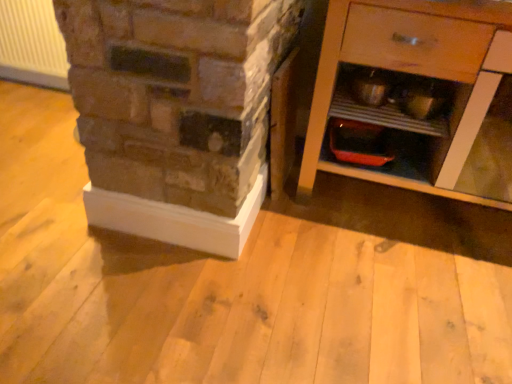
Find the location of a particular element. The height and width of the screenshot is (384, 512). white plastic radiator at upper left is located at coordinates (31, 38).

What do you see at coordinates (31, 38) in the screenshot? I see `white plastic radiator at upper left` at bounding box center [31, 38].

What do you see at coordinates (424, 89) in the screenshot? I see `wooden cabinet at right` at bounding box center [424, 89].

Measure the distance between point (430, 39) and camera.

Point (430, 39) is 1.35 meters from camera.

Identify the location of wooden cabinet at right. (424, 89).

Where is `white plastic radiator at upper left`? white plastic radiator at upper left is located at coordinates (31, 38).

Based on the photo, considering the relative positions of white plastic radiator at upper left and wooden cabinet at right in the image provided, is white plastic radiator at upper left to the right of wooden cabinet at right from the viewer's perspective?

Incorrect, white plastic radiator at upper left is not on the right side of wooden cabinet at right.

Which object is closer to the camera, white plastic radiator at upper left or wooden cabinet at right?

wooden cabinet at right is closer to the camera.

Does point (3, 15) come farther from viewer compared to point (462, 151)?

Yes, point (3, 15) is behind point (462, 151).

From the image's perspective, which is below, white plastic radiator at upper left or wooden cabinet at right?

wooden cabinet at right is shown below in the image.

From a real-world perspective, which object rests below the other?

white plastic radiator at upper left, from a real-world perspective.

Which of these two, white plastic radiator at upper left or wooden cabinet at right, is thinner?

With smaller width is white plastic radiator at upper left.

Is white plastic radiator at upper left shorter than wooden cabinet at right?

Correct, white plastic radiator at upper left is not as tall as wooden cabinet at right.

Can you confirm if white plastic radiator at upper left is smaller than wooden cabinet at right?

Indeed, white plastic radiator at upper left has a smaller size compared to wooden cabinet at right.

Which is correct: white plastic radiator at upper left is inside wooden cabinet at right, or outside of it?

white plastic radiator at upper left is spatially situated outside wooden cabinet at right.

Is white plastic radiator at upper left far from wooden cabinet at right?

Indeed, white plastic radiator at upper left is not near wooden cabinet at right.

Is white plastic radiator at upper left aimed at wooden cabinet at right?

No, white plastic radiator at upper left does not turn towards wooden cabinet at right.

Can you tell me how much white plastic radiator at upper left and wooden cabinet at right differ in facing direction?

0.0439 degrees separate the facing orientations of white plastic radiator at upper left and wooden cabinet at right.

In order to click on chest of drawers in front of the white plastic radiator at upper left in this screenshot , I will do `click(424, 89)`.

Is wooden cabinet at right to the left or to the right of white plastic radiator at upper left in the image?

Clearly, wooden cabinet at right is on the right of white plastic radiator at upper left in the image.

Between wooden cabinet at right and white plastic radiator at upper left, which one is positioned behind?

Positioned behind is white plastic radiator at upper left.

Considering the positions of point (496, 172) and point (2, 56), is point (496, 172) closer or farther from the camera than point (2, 56)?

Point (496, 172) appears to be closer to the viewer than point (2, 56).

From the image's perspective, is wooden cabinet at right located beneath white plastic radiator at upper left?

Yes, from the image's perspective, wooden cabinet at right is beneath white plastic radiator at upper left.

From a real-world perspective, who is located lower, wooden cabinet at right or white plastic radiator at upper left?

In real-world perspective, white plastic radiator at upper left is lower.

Is wooden cabinet at right wider or thinner than white plastic radiator at upper left?

Considering their sizes, wooden cabinet at right looks broader than white plastic radiator at upper left.

Can you confirm if wooden cabinet at right is taller than white plastic radiator at upper left?

Indeed, wooden cabinet at right has a greater height compared to white plastic radiator at upper left.

Between wooden cabinet at right and white plastic radiator at upper left, which one has smaller size?

white plastic radiator at upper left.

Is wooden cabinet at right positioned beyond the bounds of white plastic radiator at upper left?

Yes, wooden cabinet at right is located beyond the bounds of white plastic radiator at upper left.

In the scene shown: Would you say wooden cabinet at right is a long distance from white plastic radiator at upper left?

Yes.

Is wooden cabinet at right positioned with its back to white plastic radiator at upper left?

No.

Measure the distance from wooden cabinet at right to white plastic radiator at upper left.

wooden cabinet at right and white plastic radiator at upper left are 1.86 meters apart from each other.

At what (x,y) coordinates should I click in order to perform the action: click on chest of drawers on the right of white plastic radiator at upper left. Please return your answer as a coordinate pair (x, y). This screenshot has height=384, width=512. Looking at the image, I should click on (424, 89).

Find the location of a particular element. This screenshot has width=512, height=384. chest of drawers above the white plastic radiator at upper left (from a real-world perspective) is located at coordinates (424, 89).

Identify the location of the chest of drawers that is in front of the white plastic radiator at upper left. (424, 89).